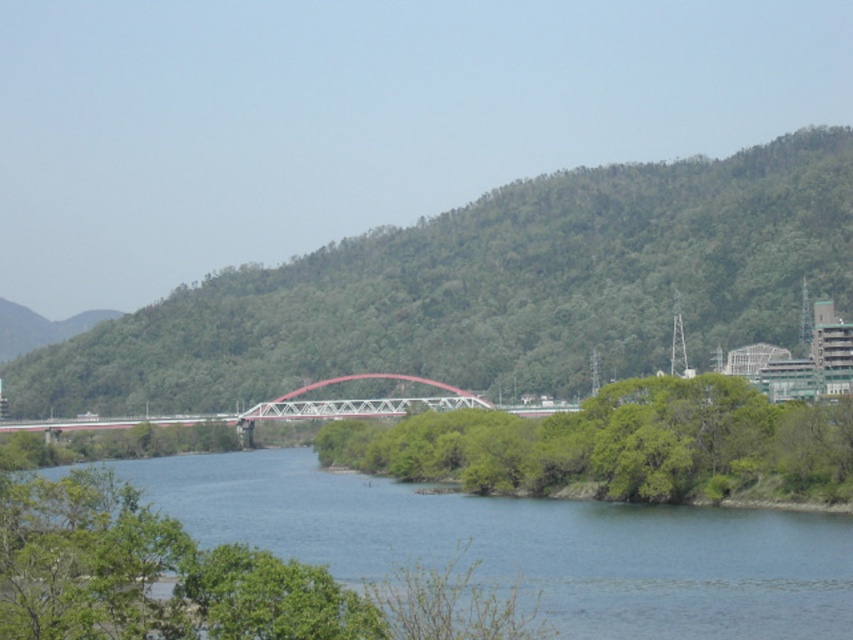
Question: Among these objects, which one is nearest to the camera?

Choices:
 (A) blue water at center
 (B) green leafy tree at center

Answer: (A)

Question: Is the position of green leafy hill at center more distant than that of metallic red bridge at center?

Choices:
 (A) no
 (B) yes

Answer: (B)

Question: Among these points, which one is farthest from the camera?

Choices:
 (A) (529, 314)
 (B) (521, 492)

Answer: (A)

Question: Can you confirm if blue water at center is smaller than metallic red bridge at center?

Choices:
 (A) yes
 (B) no

Answer: (B)

Question: Which point appears closest to the camera in this image?

Choices:
 (A) (236, 417)
 (B) (233, 467)
 (C) (695, 230)
 (D) (621, 417)

Answer: (D)

Question: Is green leafy hill at center thinner than blue water at center?

Choices:
 (A) no
 (B) yes

Answer: (A)